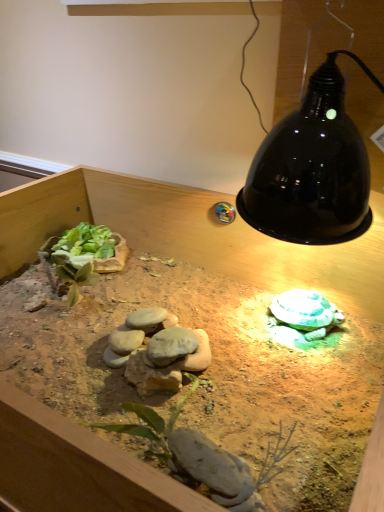
The image size is (384, 512). What are the coordinates of `wooden table at center` in the screenshot? It's located at (186, 234).

What is the approximate height of wooden table at center?

wooden table at center is 9.02 inches tall.

What do you see at coordinates (186, 234) in the screenshot? I see `wooden table at center` at bounding box center [186, 234].

What is the approximate width of wooden table at center?

wooden table at center is 62.45 centimeters wide.

This screenshot has width=384, height=512. What are the coordinates of `wooden table at center` in the screenshot? It's located at (186, 234).